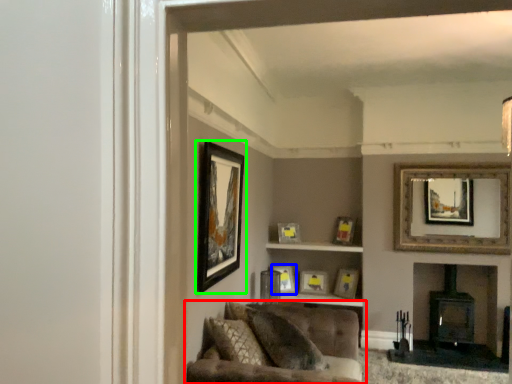
Question: Estimate the real-world distances between objects in this image. Which object is closer to studio couch (highlighted by a red box), picture frame (highlighted by a blue box) or picture frame (highlighted by a green box)?

Choices:
 (A) picture frame
 (B) picture frame

Answer: (B)